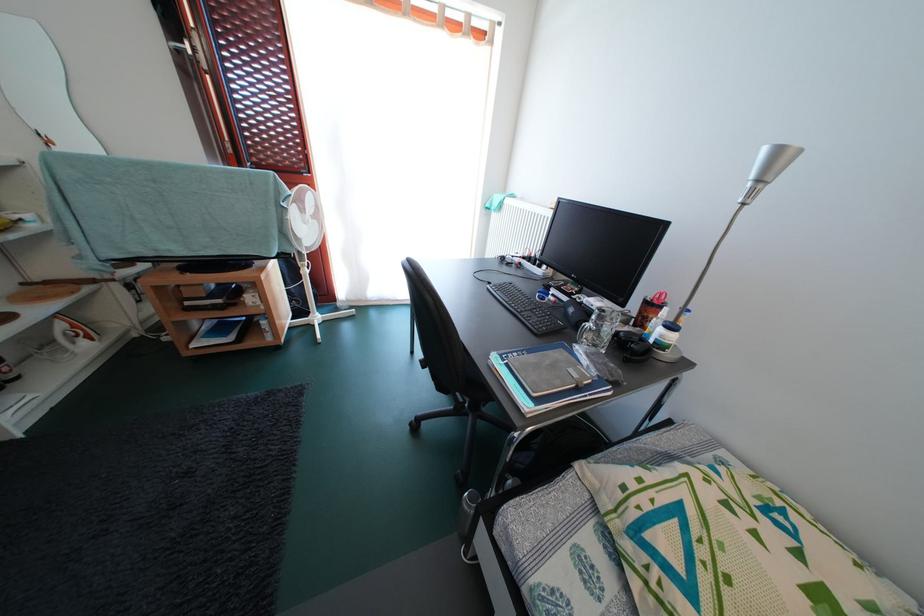
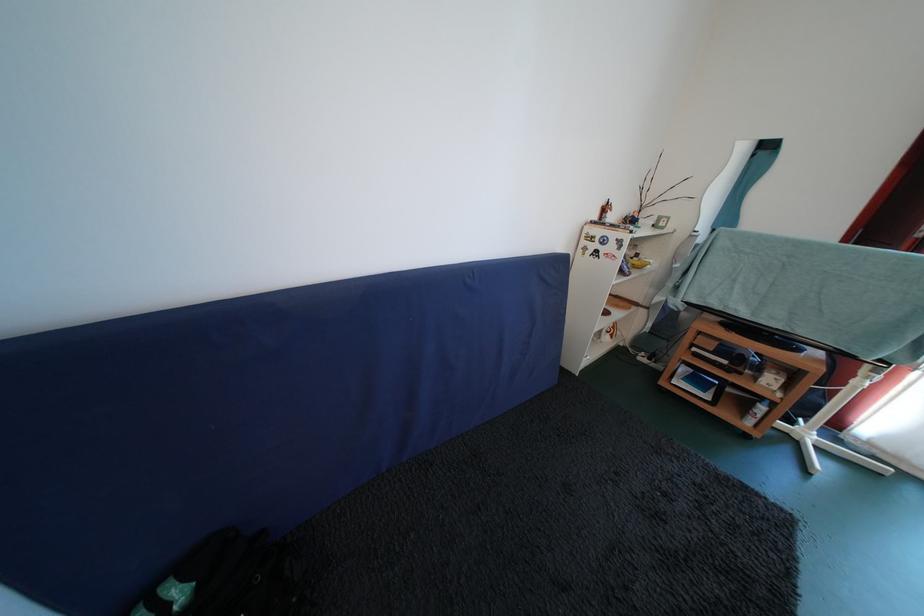
Question: The first image is from the beginning of the video and the second image is from the end. How did the camera likely rotate when shooting the video?

Choices:
 (A) Left
 (B) Right
 (C) Up
 (D) Down

Answer: (A)